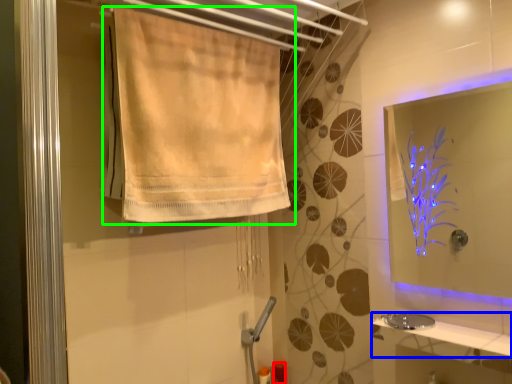
Question: Considering the real-world distances, which object is farthest from toiletry (highlighted by a red box)? counter top (highlighted by a blue box) or curtain (highlighted by a green box)?

Choices:
 (A) counter top
 (B) curtain

Answer: (B)